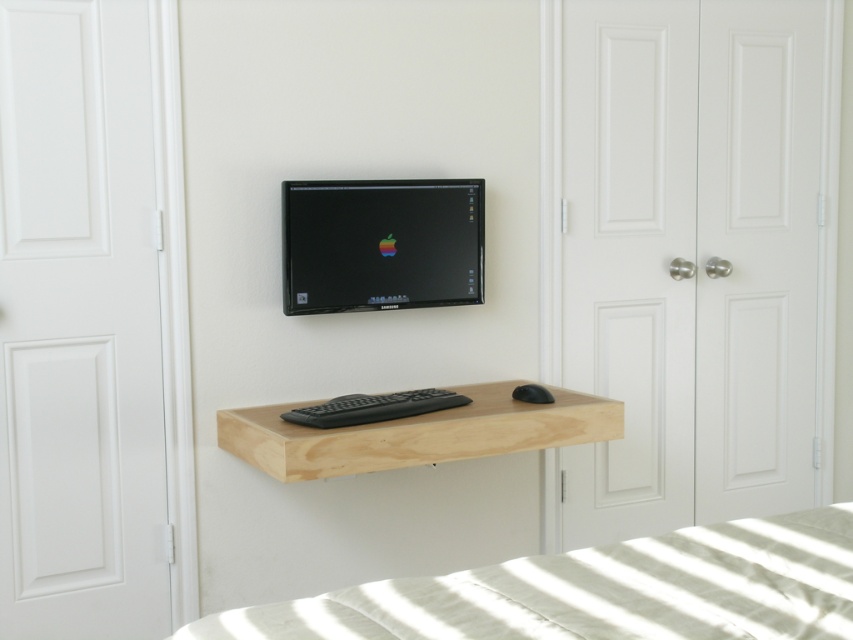
You are organizing your workspace and want to place a 5 inch wide notebook between the natural wood floating shelf at center and the black matte keyboard at center. Is there enough space for the notebook?

The natural wood floating shelf at center is 5.10 inches from the black matte keyboard at center, so there is enough space to place a 5 inch wide notebook between them.

You are organizing your workspace and want to place a new lamp between the white linen bed at lower center and the black matte mouse at center. Based on their positions, which side of the mouse should the lamp be placed on?

The white linen bed at lower center is to the left of the black matte mouse at center, so the lamp should be placed to the left side of the mouse to position it between them.

You are moving a 3.5 feet wide painting and need to place it between the white linen bed at lower center and the natural wood floating shelf at center. Is there enough space for the painting?

The distance between the white linen bed at lower center and the natural wood floating shelf at center is 3.40 feet. Since the painting is 3.5 feet wide, it is slightly wider than the available space. Therefore, the painting will not fit between them.